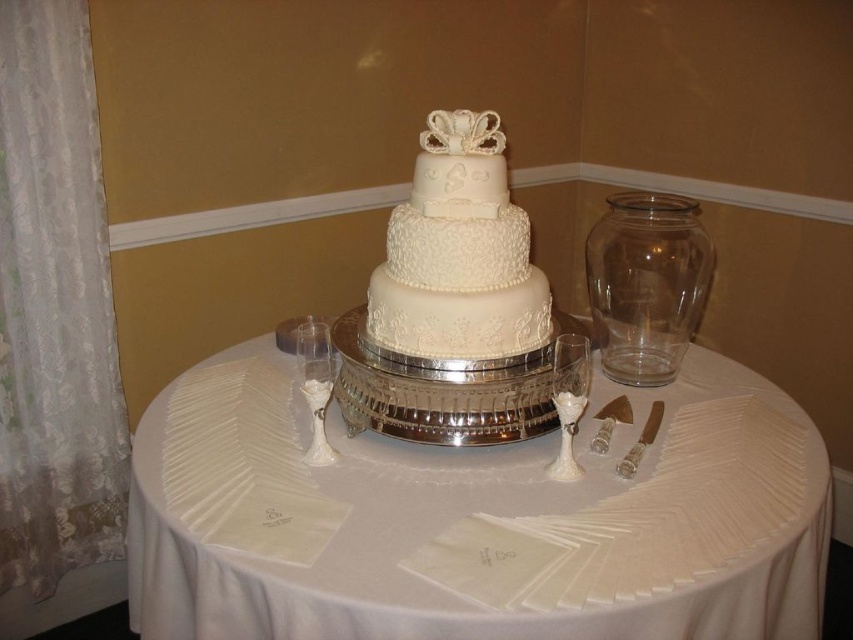
Question: Which object is closer to the camera taking this photo?

Choices:
 (A) white frosted wine glass at center
 (B) white textured cake at center
 (C) white porcelain wine glass at center-left
 (D) gold metallic knife at center

Answer: (A)

Question: Estimate the real-world distances between objects in this image. Which object is closer to the white frosted wine glass at center?

Choices:
 (A) white porcelain wine glass at center-left
 (B) shiny silver knife at right
 (C) white satin tablecloth at center
 (D) white textured cake at center

Answer: (B)

Question: Does white frosted wine glass at center appear on the right side of gold metallic knife at center?

Choices:
 (A) no
 (B) yes

Answer: (A)

Question: Which object is the farthest from the white satin tablecloth at center?

Choices:
 (A) white frosted wine glass at center
 (B) gold metallic knife at center
 (C) shiny silver knife at right
 (D) white textured cake at center

Answer: (B)

Question: Is white textured cake at center behind white porcelain wine glass at center-left?

Choices:
 (A) yes
 (B) no

Answer: (A)

Question: Does white satin tablecloth at center appear on the right side of white porcelain wine glass at center-left?

Choices:
 (A) yes
 (B) no

Answer: (A)